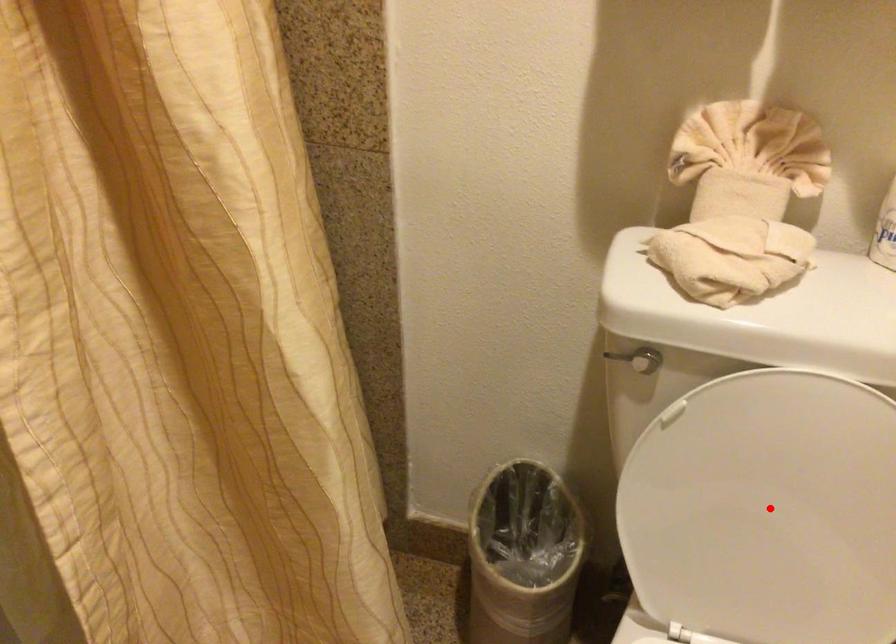
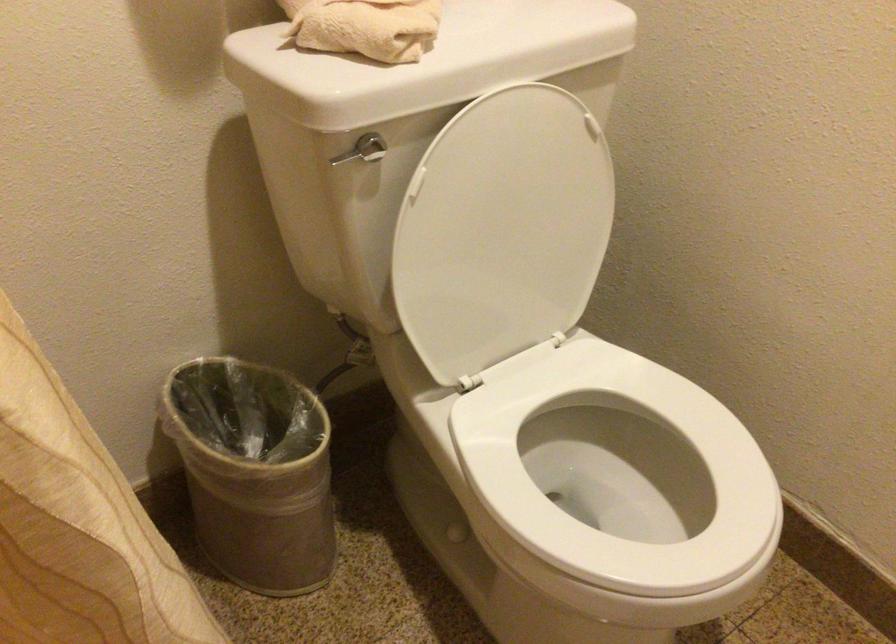
Question: I am providing you with two images of the same scene from different viewpoints. Given a red point in image1, look at the same physical point in image2. Is it:

Choices:
 (A) Closer to the viewpoint
 (B) Farther from the viewpoint

Answer: (B)